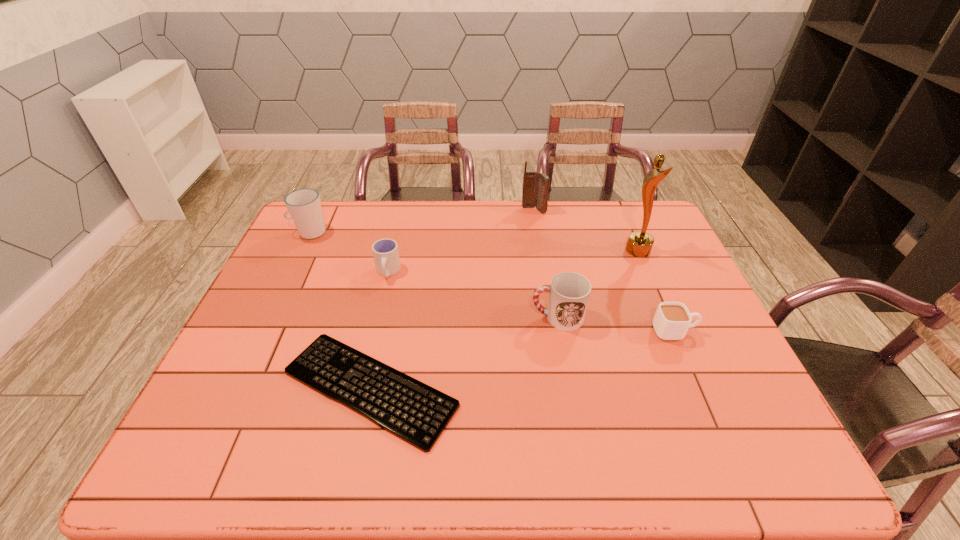
Image resolution: width=960 pixels, height=540 pixels. In order to click on free space located 0.050m on the side with the handle of the second shortest object in this screenshot , I will do `click(715, 331)`.

Identify the location of vacant space located 0.150m on the back of the computer keyboard. The width and height of the screenshot is (960, 540). (390, 296).

The image size is (960, 540). What are the coordinates of `award situated at the far edge` in the screenshot? It's located at (639, 244).

I want to click on cellular telephone that is at the far edge, so click(535, 185).

This screenshot has width=960, height=540. I want to click on cup present at the far edge, so click(x=304, y=206).

Where is `object present at the near edge`? The width and height of the screenshot is (960, 540). object present at the near edge is located at coordinates (413, 411).

Identify the location of cup that is at the left edge. (304, 206).

You are a GUI agent. You are given a task and a screenshot of the screen. Output one action in this format:
    pyautogui.click(x=<x>, y=<y>)
    Task: Click on the computer keyboard present at the left edge
    
    Given the screenshot: What is the action you would take?
    pyautogui.click(x=413, y=411)

Locate an element on the screen. Image resolution: width=960 pixels, height=540 pixels. award that is positioned at the right edge is located at coordinates (639, 244).

Locate an element on the screen. cup that is at the right edge is located at coordinates (671, 321).